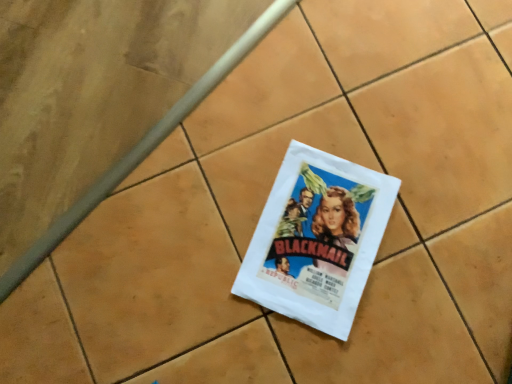
Where is `free space above white paper poster at center (from a real-world perspective)`? The height and width of the screenshot is (384, 512). free space above white paper poster at center (from a real-world perspective) is located at coordinates (314, 238).